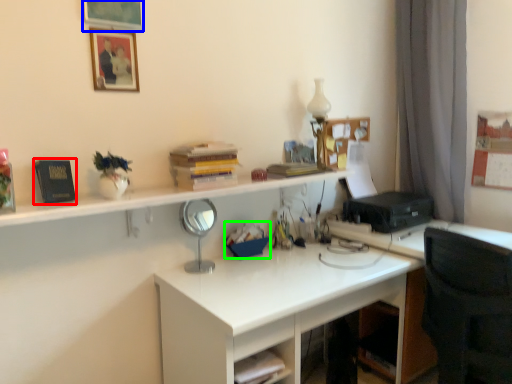
Question: Considering the real-world distances, which object is farthest from book (highlighted by a red box)? picture frame (highlighted by a blue box) or stationery (highlighted by a green box)?

Choices:
 (A) picture frame
 (B) stationery

Answer: (B)